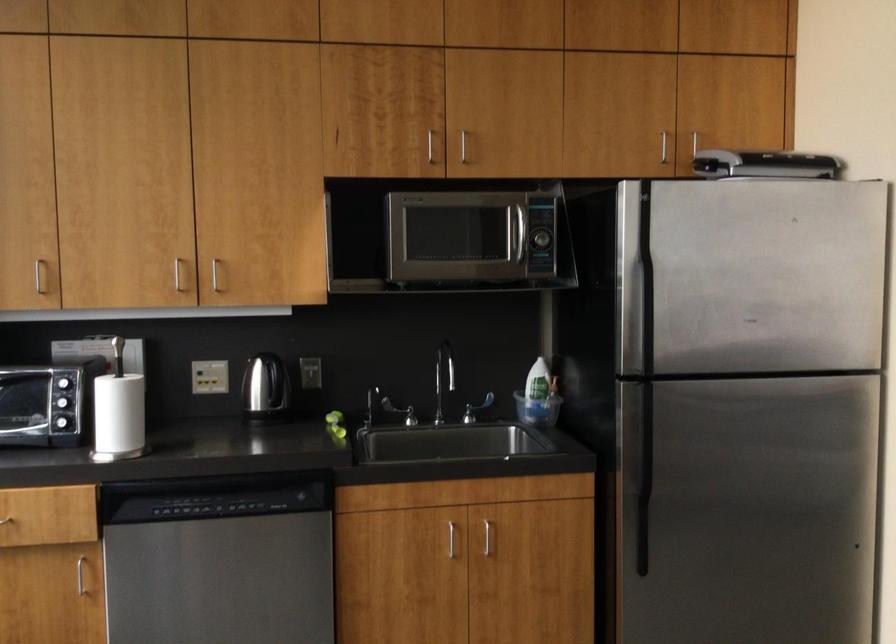
Find where to pull the freezer door handle. Please return your answer as a coordinate pair (x, y).

(636, 267)